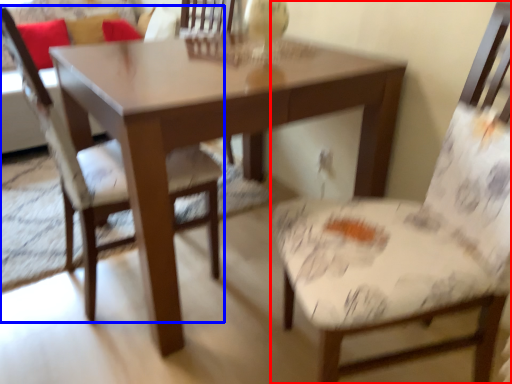
Question: Which object is further to the camera taking this photo, chair (highlighted by a red box) or chair (highlighted by a blue box)?

Choices:
 (A) chair
 (B) chair

Answer: (B)